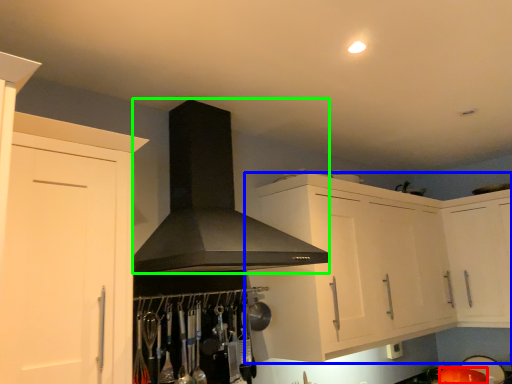
Question: Based on their relative distances, which object is farther from appliance (highlighted by a red box)? Choose from cabinetry (highlighted by a blue box) and fume hood (highlighted by a green box).

Choices:
 (A) cabinetry
 (B) fume hood

Answer: (B)